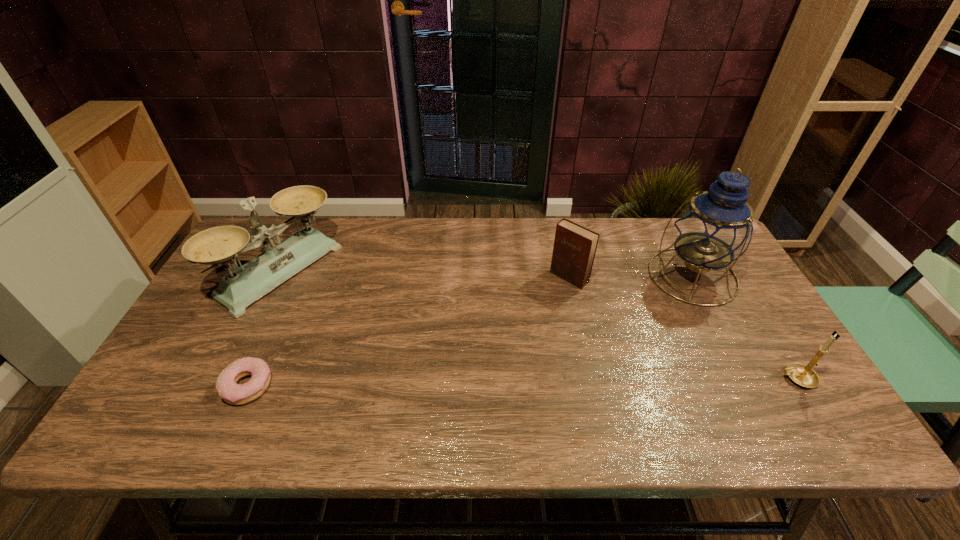
This screenshot has height=540, width=960. Find the location of `free space located on the front cover of the diary`. free space located on the front cover of the diary is located at coordinates (474, 364).

This screenshot has height=540, width=960. Identify the location of vacant area situated on the front cover of the diary. (532, 311).

I want to click on vacant space located on the front-facing side of the tallest object, so click(x=649, y=303).

Identify the location of vacant space positioned 0.280m on the front-facing side of the tallest object. The width and height of the screenshot is (960, 540). (597, 338).

The width and height of the screenshot is (960, 540). Identify the location of blank space located on the front-facing side of the tallest object. (626, 319).

Locate an element on the screen. free spot located on the front-facing side of the scale is located at coordinates (385, 342).

This screenshot has height=540, width=960. What are the coordinates of `vacant space situated on the front-facing side of the scale` in the screenshot? It's located at (358, 325).

The image size is (960, 540). I want to click on vacant space located 0.160m on the front-facing side of the scale, so click(x=352, y=322).

I want to click on lantern positioned at the far edge, so click(716, 227).

At what (x,y) coordinates should I click in order to perform the action: click on scale located in the far edge section of the desktop. Please return your answer as a coordinate pair (x, y). The image size is (960, 540). Looking at the image, I should click on (237, 290).